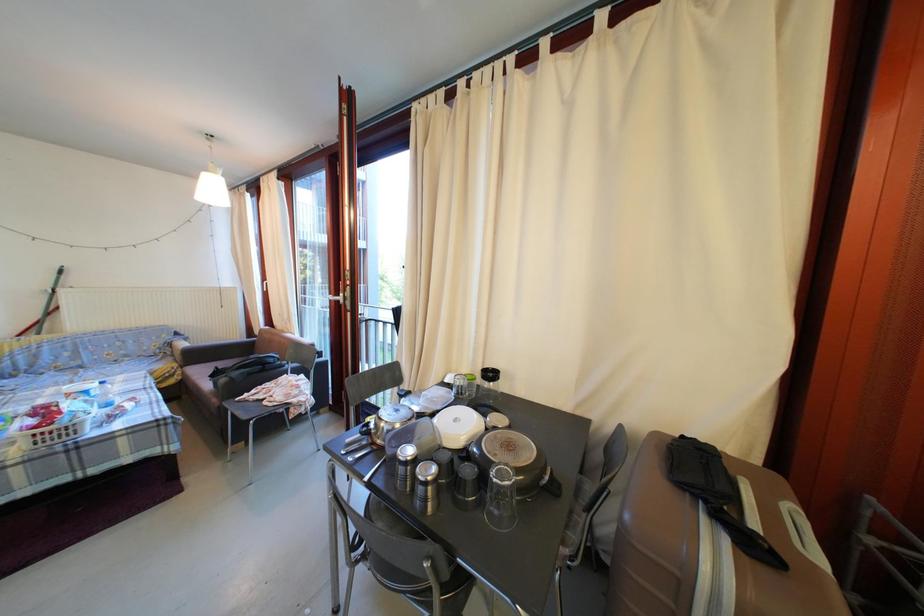
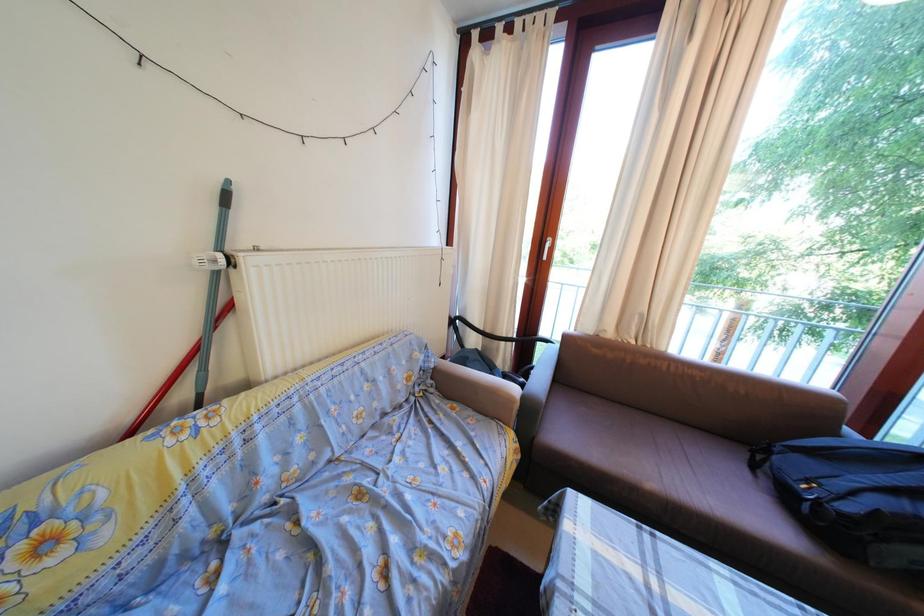
In a continuous first-person perspective shot, in which direction is the camera moving?

The cameraman walked toward left, forward.